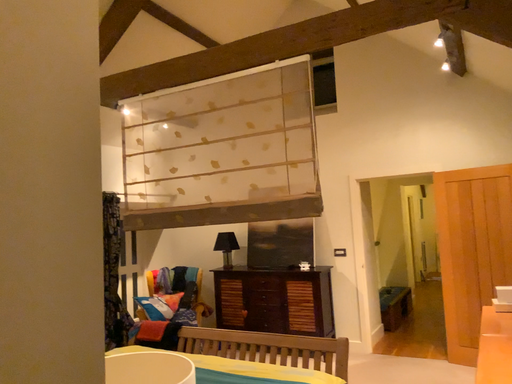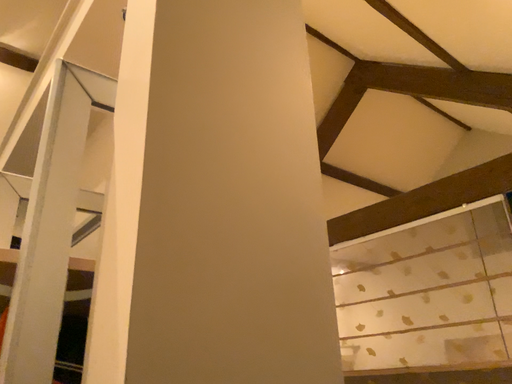
Question: How did the camera likely rotate when shooting the video?

Choices:
 (A) rotated upward
 (B) rotated downward

Answer: (A)